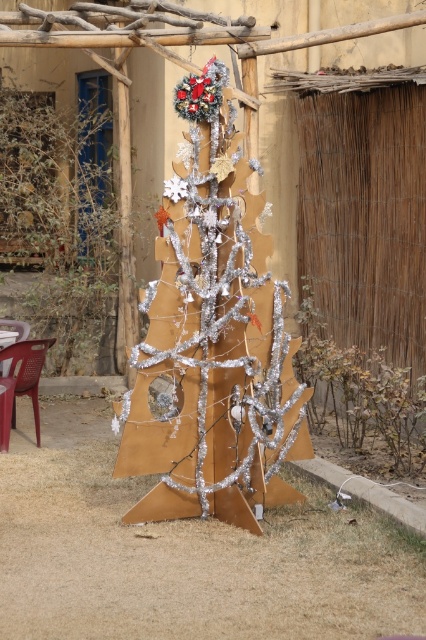
You are standing in front of the Christmas tree scene. You see the silver metallic christmas tree at center and the shiny silver tree at center. Which one is positioned to the right?

The silver metallic christmas tree at center is positioned to the right of the shiny silver tree at center.

You are setting up a living room for the holidays. You have a shiny silver tree at center and a silver metallic tree at center. Which tree should you choose if you want the tallest tree in your living room?

The shiny silver tree at center is much taller than the silver metallic tree at center, so you should choose the shiny silver tree at center for the tallest tree in your living room.